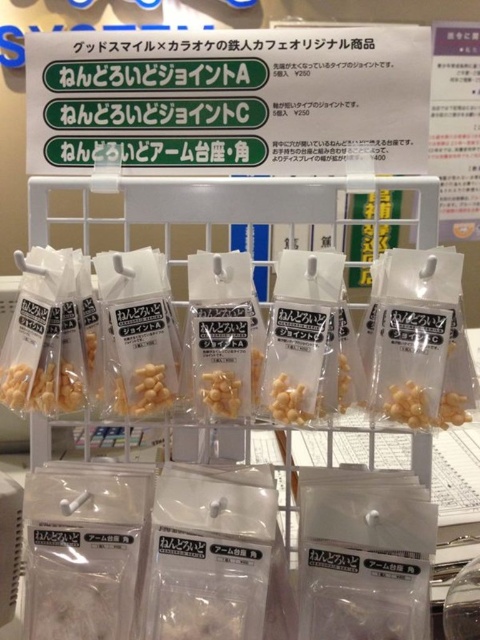
You are a customer looking at the display stand with the white plastic sign at upper center and the yellow matte joint at center. Which object is taller?

The white plastic sign at upper center is taller than the yellow matte joint at center.